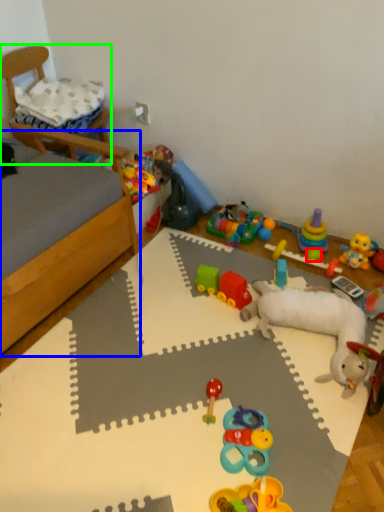
Question: Which is farther away from toy (highlighted by a red box)? bed frame (highlighted by a blue box) or furniture (highlighted by a green box)?

Choices:
 (A) bed frame
 (B) furniture

Answer: (B)